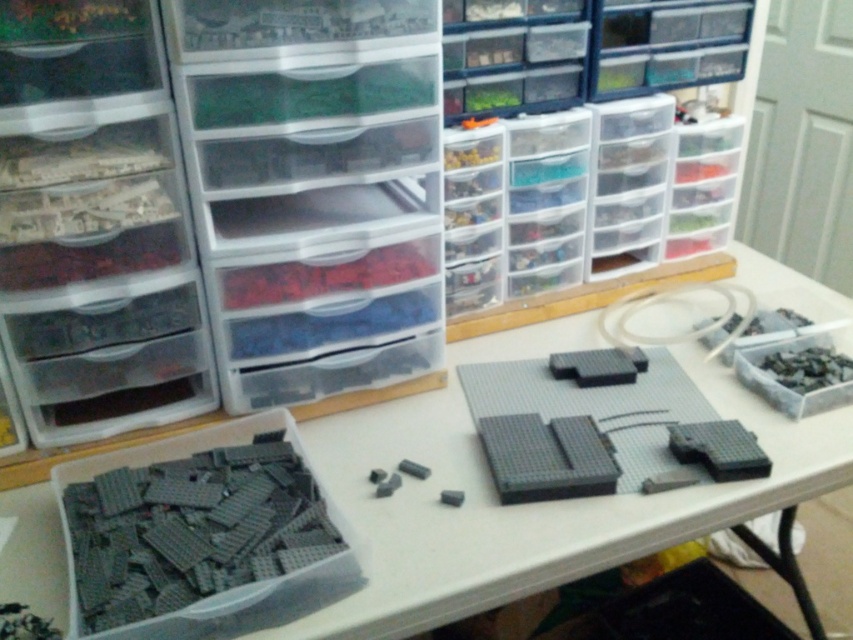
You are a LEGO enthusiast who wants to place all the gray matte lego bricks at lower left onto the transparent plastic table at center. Given that the table has enough space, will the bricks fit without overlapping?

The transparent plastic table at center has a larger size compared to gray matte lego bricks at lower left, so yes, the bricks will fit without overlapping as there is sufficient space on the table.

You are a robot tasked with picking up items from the workspace. You need to pick up an item located at point (338, 456) and another item at point (225, 611). Which item should you pick up first to minimize the distance traveled?

You should pick up the item at point (338, 456) first because it is closer to you than the item at point (225, 611), so you can reach it without moving further away first.

What object is located at the coordinates point (524, 504) in the workspace?

The point (524, 504) marks the transparent plastic table at center.